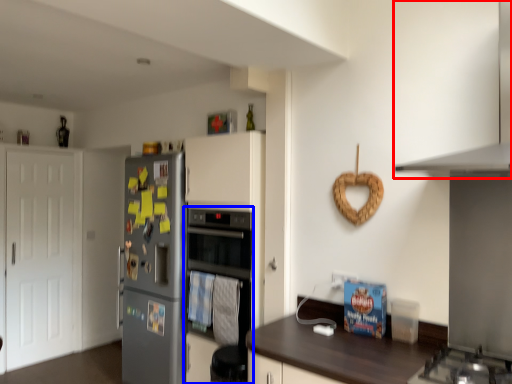
Question: Among these objects, which one is farthest to the camera, exhaust hood (highlighted by a red box) or oven (highlighted by a blue box)?

Choices:
 (A) exhaust hood
 (B) oven

Answer: (B)